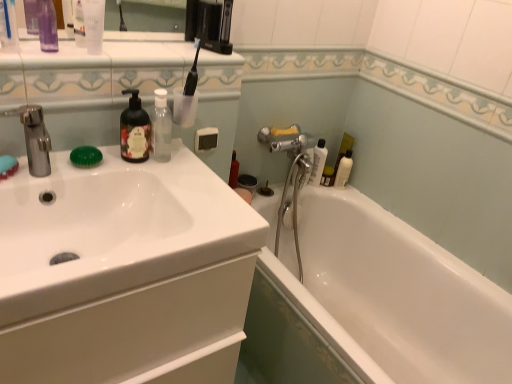
Locate an element on the screen. The height and width of the screenshot is (384, 512). free space in front of transparent plastic bottle at upper center, the 1th mouthwash when ordered from right to left is located at coordinates (157, 177).